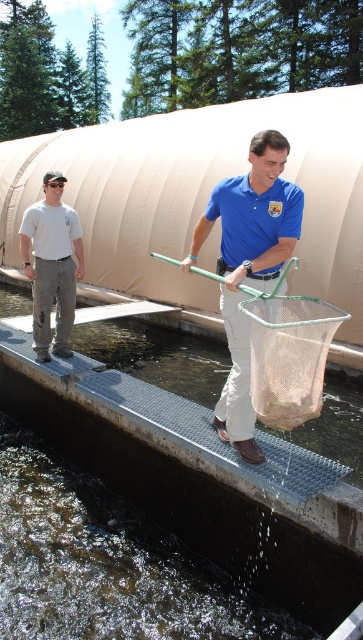
Question: Which of the following is the closest to the observer?

Choices:
 (A) (250, 179)
 (B) (46, 564)
 (C) (323, 355)

Answer: (C)

Question: Among these objects, which one is farthest from the camera?

Choices:
 (A) clear liquid water at center
 (B) blue smooth shirt at center
 (C) metal mesh net at center

Answer: (A)

Question: Which of the following is the closest to the observer?

Choices:
 (A) (72, 218)
 (B) (271, 273)

Answer: (B)

Question: Is clear liquid water at center below blue smooth shirt at center?

Choices:
 (A) no
 (B) yes

Answer: (B)

Question: Is blue smooth shirt at center above white cotton shirt at left?

Choices:
 (A) no
 (B) yes

Answer: (A)

Question: Is blue smooth shirt at center below metal mesh net at center?

Choices:
 (A) no
 (B) yes

Answer: (A)